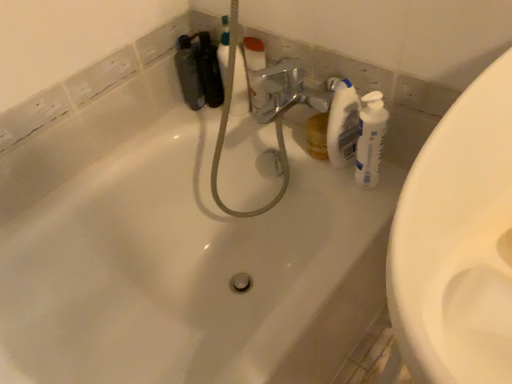
Identify the location of matte black bottle at upper left. This screenshot has height=384, width=512. (189, 72).

What is the approximate width of matte black bottle at upper left?

4.55 inches.

Find the location of a particular element. white plastic bottle at right, placed as the second cleaning product when sorted from left to right is located at coordinates (370, 139).

The width and height of the screenshot is (512, 384). Find the location of `white glossy bathtub at center`. white glossy bathtub at center is located at coordinates (179, 253).

Considering the relative sizes of matte black bottle at upper left and translucent plastic bottle at upper right, acting as the 2th cleaning product starting from the right, in the image provided, is matte black bottle at upper left smaller than translucent plastic bottle at upper right, acting as the 2th cleaning product starting from the right,?

Actually, matte black bottle at upper left might be larger than translucent plastic bottle at upper right, acting as the 2th cleaning product starting from the right.

Which object is thinner, matte black bottle at upper left or translucent plastic bottle at upper right, acting as the 2th cleaning product starting from the right?

translucent plastic bottle at upper right, acting as the 2th cleaning product starting from the right.

Identify the location of toiletry behind the translucent plastic bottle at upper right, acting as the 2th cleaning product starting from the right. Image resolution: width=512 pixels, height=384 pixels. (189, 72).

From the image's perspective, is matte black bottle at upper left located above or below translucent plastic bottle at upper right, acting as the first cleaning product starting from the left?

Clearly, from the image's perspective, matte black bottle at upper left is above translucent plastic bottle at upper right, acting as the first cleaning product starting from the left.

Can you tell me how much white glossy bathtub at center and white plastic bottle at right, the first cleaning product positioned from the right, differ in facing direction?

white glossy bathtub at center and white plastic bottle at right, the first cleaning product positioned from the right, are facing 91.1 degrees away from each other.

Is white glossy bathtub at center in front of or behind white plastic bottle at right, the first cleaning product positioned from the right, in the image?

Visually, white glossy bathtub at center is located in front of white plastic bottle at right, the first cleaning product positioned from the right.

From a real-world perspective, is white glossy bathtub at center on top of white plastic bottle at right, the first cleaning product positioned from the right?

Incorrect, from a real-world perspective, white glossy bathtub at center is lower than white plastic bottle at right, the first cleaning product positioned from the right.

Is white glossy bathtub at center oriented towards white plastic bottle at right, the first cleaning product positioned from the right?

No, white glossy bathtub at center is not facing towards white plastic bottle at right, the first cleaning product positioned from the right.

Considering the relative sizes of matte black bottle at upper left and white glossy bathtub at center in the image provided, is matte black bottle at upper left taller than white glossy bathtub at center?

In fact, matte black bottle at upper left may be shorter than white glossy bathtub at center.

Does matte black bottle at upper left have a smaller size compared to white glossy bathtub at center?

Yes, matte black bottle at upper left is smaller than white glossy bathtub at center.

Is matte black bottle at upper left behind white glossy bathtub at center?

Yes, matte black bottle at upper left is behind white glossy bathtub at center.

In the image, is matte black bottle at upper left on the left side or the right side of white glossy bathtub at center?

Clearly, matte black bottle at upper left is on the left of white glossy bathtub at center in the image.

Find the location of a particular element. The width and height of the screenshot is (512, 384). bathtub in front of the translucent plastic bottle at upper right, acting as the first cleaning product starting from the left is located at coordinates (179, 253).

Which is closer, (332, 82) or (192, 276)?

Positioned in front is point (332, 82).

Can you confirm if translucent plastic bottle at upper right, acting as the first cleaning product starting from the left, is shorter than white glossy bathtub at center?

Indeed, translucent plastic bottle at upper right, acting as the first cleaning product starting from the left, has a lesser height compared to white glossy bathtub at center.

What's the angular difference between white glossy bathtub at center and matte black bottle at upper left's facing directions?

66.5 degrees.

Is there a large distance between white glossy bathtub at center and matte black bottle at upper left?

No, white glossy bathtub at center is not far from matte black bottle at upper left.

Looking at this image, from the image's perspective, is white glossy bathtub at center on matte black bottle at upper left?

No, from the image's perspective, white glossy bathtub at center is not on top of matte black bottle at upper left.

In the image, is white glossy bathtub at center on the left side or the right side of translucent plastic bottle at upper right, acting as the first cleaning product starting from the left?

From the image, it's evident that white glossy bathtub at center is to the left of translucent plastic bottle at upper right, acting as the first cleaning product starting from the left.

Between white glossy bathtub at center and translucent plastic bottle at upper right, acting as the first cleaning product starting from the left, which one has larger width?

white glossy bathtub at center is wider.

Between white glossy bathtub at center and translucent plastic bottle at upper right, acting as the 2th cleaning product starting from the right, which one has smaller size?

Smaller between the two is translucent plastic bottle at upper right, acting as the 2th cleaning product starting from the right.

Considering the relative positions of white glossy bathtub at center and translucent plastic bottle at upper right, acting as the 2th cleaning product starting from the right, in the image provided, is white glossy bathtub at center behind translucent plastic bottle at upper right, acting as the 2th cleaning product starting from the right,?

No, white glossy bathtub at center is closer to the viewer.

From a real-world perspective, is translucent plastic bottle at upper right, acting as the 2th cleaning product starting from the right, positioned under matte black bottle at upper left based on gravity?

No, from a real-world perspective, translucent plastic bottle at upper right, acting as the 2th cleaning product starting from the right, is not below matte black bottle at upper left.

Is translucent plastic bottle at upper right, acting as the first cleaning product starting from the left, beside matte black bottle at upper left?

No, translucent plastic bottle at upper right, acting as the first cleaning product starting from the left, is not next to matte black bottle at upper left.

Considering the positions of objects translucent plastic bottle at upper right, acting as the first cleaning product starting from the left, and matte black bottle at upper left in the image provided, who is more to the left, translucent plastic bottle at upper right, acting as the first cleaning product starting from the left, or matte black bottle at upper left?

matte black bottle at upper left.

Can you confirm if translucent plastic bottle at upper right, acting as the first cleaning product starting from the left, is taller than matte black bottle at upper left?

Yes, translucent plastic bottle at upper right, acting as the first cleaning product starting from the left, is taller than matte black bottle at upper left.

In the image, there is a translucent plastic bottle at upper right, acting as the first cleaning product starting from the left. What are the coordinates of `toiletry above it (from the image's perspective)` in the screenshot? It's located at (189, 72).

You are a GUI agent. You are given a task and a screenshot of the screen. Output one action in this format:
    pyautogui.click(x=<x>, y=<y>)
    Task: Click on the 1st cleaning product behind the white glossy bathtub at center, starting your count from the anchor
    This screenshot has width=512, height=384.
    Given the screenshot: What is the action you would take?
    pyautogui.click(x=370, y=139)

Looking at the image, which one is located closer to matte black bottle at upper left, white glossy bathtub at center or translucent plastic bottle at upper right, acting as the 2th cleaning product starting from the right?

Based on the image, white glossy bathtub at center appears to be nearer to matte black bottle at upper left.

Considering their positions, is translucent plastic bottle at upper right, acting as the 2th cleaning product starting from the right, positioned further to matte black bottle at upper left than white glossy bathtub at center?

Based on the image, translucent plastic bottle at upper right, acting as the 2th cleaning product starting from the right, appears to be further to matte black bottle at upper left.

When comparing their distances from white plastic bottle at right, the first cleaning product positioned from the right, does matte black bottle at upper left or translucent plastic bottle at upper right, acting as the first cleaning product starting from the left, seem further?

matte black bottle at upper left.

From the image, which object appears to be nearer to white glossy bathtub at center, matte black bottle at upper left or white plastic bottle at right, the first cleaning product positioned from the right?

Based on the image, matte black bottle at upper left appears to be nearer to white glossy bathtub at center.

Considering their positions, is translucent plastic bottle at upper right, acting as the 2th cleaning product starting from the right, positioned closer to white glossy bathtub at center than matte black bottle at upper left?

matte black bottle at upper left lies closer to white glossy bathtub at center than the other object.

When comparing their distances from white glossy bathtub at center, does translucent plastic bottle at upper right, acting as the 2th cleaning product starting from the right, or white plastic bottle at right, placed as the second cleaning product when sorted from left to right, seem closer?

translucent plastic bottle at upper right, acting as the 2th cleaning product starting from the right.

Which object lies nearer to the anchor point white glossy bathtub at center, white plastic bottle at right, the first cleaning product positioned from the right, or translucent plastic bottle at upper right, acting as the first cleaning product starting from the left?

translucent plastic bottle at upper right, acting as the first cleaning product starting from the left, is positioned closer to the anchor white glossy bathtub at center.

Estimate the real-world distances between objects in this image. Which object is further from white plastic bottle at right, placed as the second cleaning product when sorted from left to right, translucent plastic bottle at upper right, acting as the 2th cleaning product starting from the right, or matte black bottle at upper left?

Based on the image, matte black bottle at upper left appears to be further to white plastic bottle at right, placed as the second cleaning product when sorted from left to right.

Where is `cleaning product situated between matte black bottle at upper left and white plastic bottle at right, placed as the second cleaning product when sorted from left to right, from left to right`? The width and height of the screenshot is (512, 384). cleaning product situated between matte black bottle at upper left and white plastic bottle at right, placed as the second cleaning product when sorted from left to right, from left to right is located at coordinates (342, 122).

At what (x,y) coordinates should I click in order to perform the action: click on cleaning product between translucent plastic bottle at upper right, acting as the first cleaning product starting from the left, and white glossy bathtub at center, in the vertical direction. Please return your answer as a coordinate pair (x, y). The height and width of the screenshot is (384, 512). Looking at the image, I should click on (370, 139).